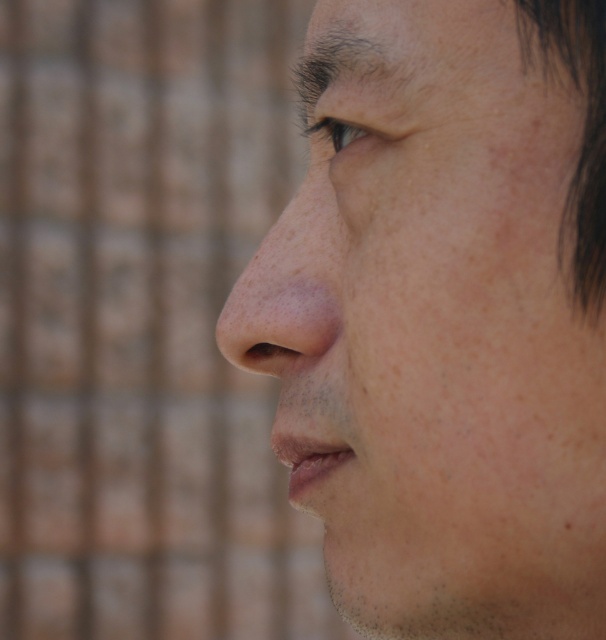
Is dry skin nose at center taller than dark brown eye at upper center?

Correct, dry skin nose at center is much taller as dark brown eye at upper center.

Describe the element at coordinates (290, 288) in the screenshot. I see `dry skin nose at center` at that location.

Identify the location of dry skin nose at center. This screenshot has width=606, height=640. (290, 288).

Is point (333, 52) farther from viewer compared to point (364, 125)?

Yes, point (333, 52) is farther from viewer.

Between point (231, 291) and point (370, 132), which one is positioned behind?

The point (231, 291) is behind.

Identify the location of smooth skin face at center. This screenshot has width=606, height=640. 445,316.

You are a GUI agent. You are given a task and a screenshot of the screen. Output one action in this format:
    pyautogui.click(x=<x>, y=<y>)
    Task: Click on the smooth skin face at center
    The image size is (606, 640).
    Given the screenshot: What is the action you would take?
    pyautogui.click(x=445, y=316)

How distant is smooth skin face at center from dry skin nose at center?

smooth skin face at center is 1.33 inches from dry skin nose at center.

Does smooth skin face at center appear on the left side of dry skin nose at center?

A: In fact, smooth skin face at center is to the right of dry skin nose at center.

This screenshot has height=640, width=606. Describe the element at coordinates (445, 316) in the screenshot. I see `smooth skin face at center` at that location.

The width and height of the screenshot is (606, 640). Find the location of `smooth skin face at center`. smooth skin face at center is located at coordinates (445, 316).